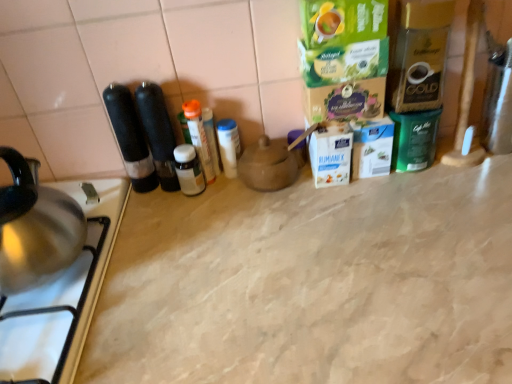
Question: Would you say matte brown teapot at center is outside stainless steel gas stove at lower left?

Choices:
 (A) no
 (B) yes

Answer: (B)

Question: Considering the relative positions of matte brown teapot at center and stainless steel gas stove at lower left in the image provided, is matte brown teapot at center to the left of stainless steel gas stove at lower left from the viewer's perspective?

Choices:
 (A) yes
 (B) no

Answer: (B)

Question: From the image's perspective, would you say matte brown teapot at center is shown under stainless steel gas stove at lower left?

Choices:
 (A) yes
 (B) no

Answer: (B)

Question: Considering the relative sizes of matte brown teapot at center and stainless steel gas stove at lower left in the image provided, is matte brown teapot at center taller than stainless steel gas stove at lower left?

Choices:
 (A) no
 (B) yes

Answer: (A)

Question: Is matte brown teapot at center positioned far away from stainless steel gas stove at lower left?

Choices:
 (A) no
 (B) yes

Answer: (A)

Question: Is matte brown teapot at center in front of or behind beige marble counter top at center in the image?

Choices:
 (A) front
 (B) behind

Answer: (B)

Question: Looking at the image, does matte brown teapot at center seem bigger or smaller compared to beige marble counter top at center?

Choices:
 (A) small
 (B) big

Answer: (A)

Question: Is matte brown teapot at center taller or shorter than beige marble counter top at center?

Choices:
 (A) short
 (B) tall

Answer: (A)

Question: Based on their positions, is matte brown teapot at center located to the left or right of beige marble counter top at center?

Choices:
 (A) left
 (B) right

Answer: (A)

Question: Would you say translucent plastic bottle at center, placed as the second bottle when sorted from left to right, is inside or outside beige marble counter top at center?

Choices:
 (A) outside
 (B) inside

Answer: (A)

Question: Based on their sizes in the image, would you say translucent plastic bottle at center, placed as the second bottle when sorted from left to right, is bigger or smaller than beige marble counter top at center?

Choices:
 (A) small
 (B) big

Answer: (A)

Question: Would you say translucent plastic bottle at center, the 2th bottle from the right, is to the left or to the right of beige marble counter top at center in the picture?

Choices:
 (A) left
 (B) right

Answer: (A)

Question: From a real-world perspective, is translucent plastic bottle at center, the 2th bottle from the right, above or below beige marble counter top at center?

Choices:
 (A) above
 (B) below

Answer: (A)

Question: Looking at the image, does matte brown teapot at center seem bigger or smaller compared to white plastic container at center, the 3th bottle in the left-to-right sequence?

Choices:
 (A) small
 (B) big

Answer: (B)

Question: Considering the positions of point (248, 183) and point (224, 145), is point (248, 183) closer or farther from the camera than point (224, 145)?

Choices:
 (A) closer
 (B) farther

Answer: (B)